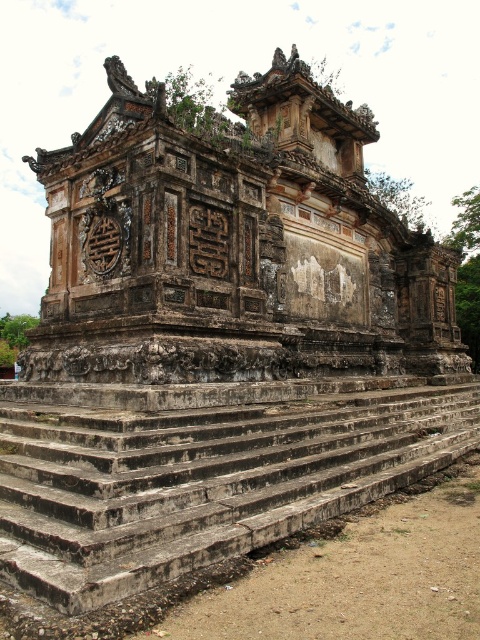
Question: Can you confirm if weathered stone structure at center is positioned to the left of weathered stone stairs at center?

Choices:
 (A) no
 (B) yes

Answer: (A)

Question: Which point appears closest to the camera in this image?

Choices:
 (A) (131, 540)
 (B) (219, 356)

Answer: (A)

Question: Which point is farther to the camera?

Choices:
 (A) weathered stone stairs at center
 (B) weathered stone structure at center

Answer: (B)

Question: Is weathered stone structure at center wider than weathered stone stairs at center?

Choices:
 (A) yes
 (B) no

Answer: (A)

Question: Is weathered stone structure at center above weathered stone stairs at center?

Choices:
 (A) no
 (B) yes

Answer: (B)